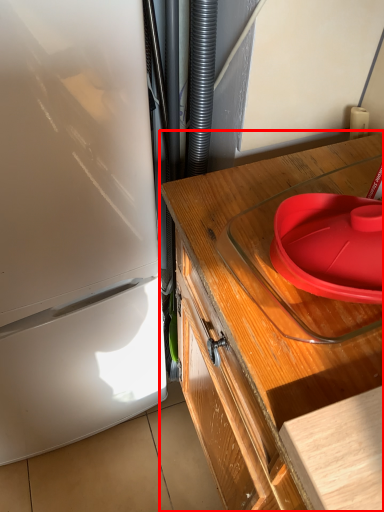
Question: In this image, where is countertop (annotated by the red box) located relative to plate?

Choices:
 (A) right
 (B) left

Answer: (B)